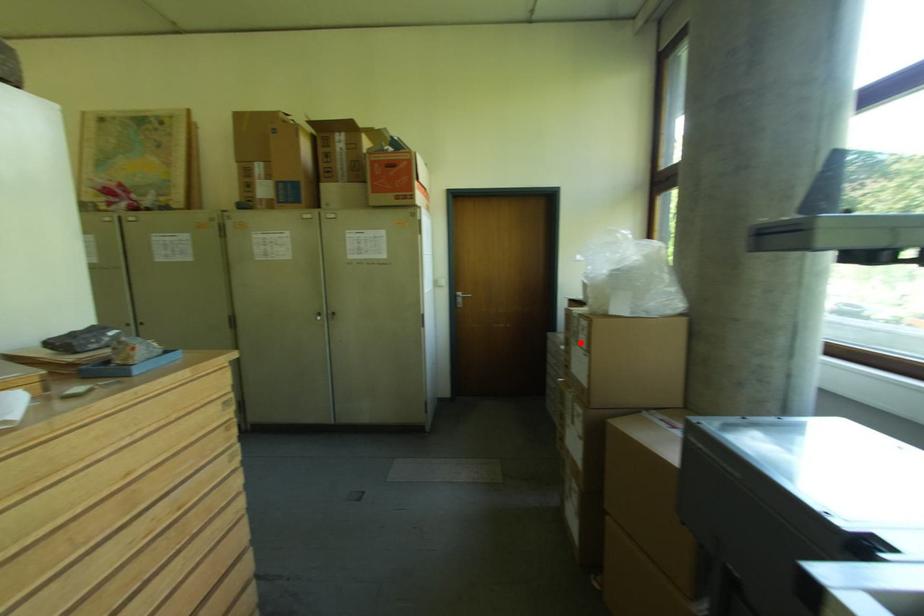
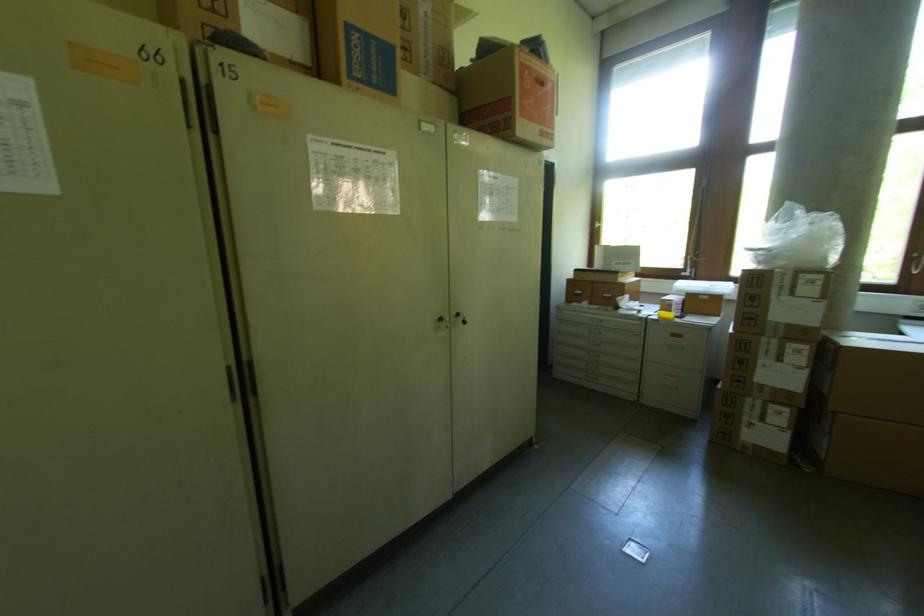
Question: A red point is marked in image1. In image2, is the corresponding 3D point closer to the camera or farther? Reply with the corresponding letter.

Choices:
 (A) The corresponding 3D point is closer.
 (B) The corresponding 3D point is farther.

Answer: (B)